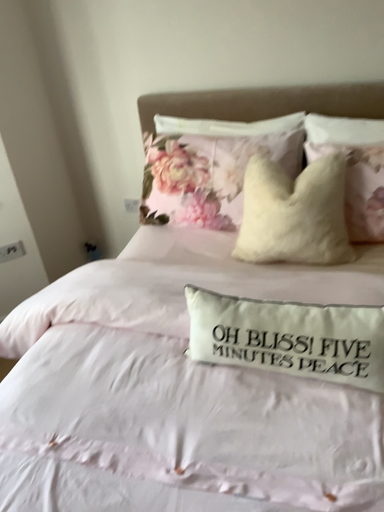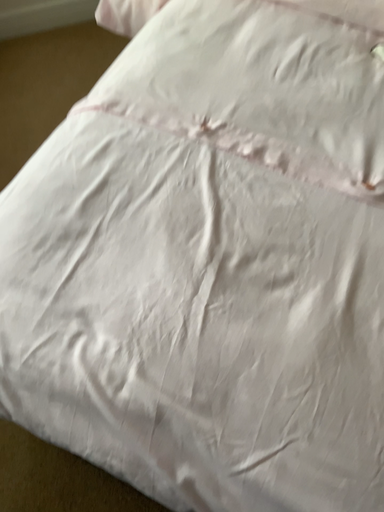
Question: How did the camera likely rotate when shooting the video?

Choices:
 (A) rotated upward
 (B) rotated downward

Answer: (B)